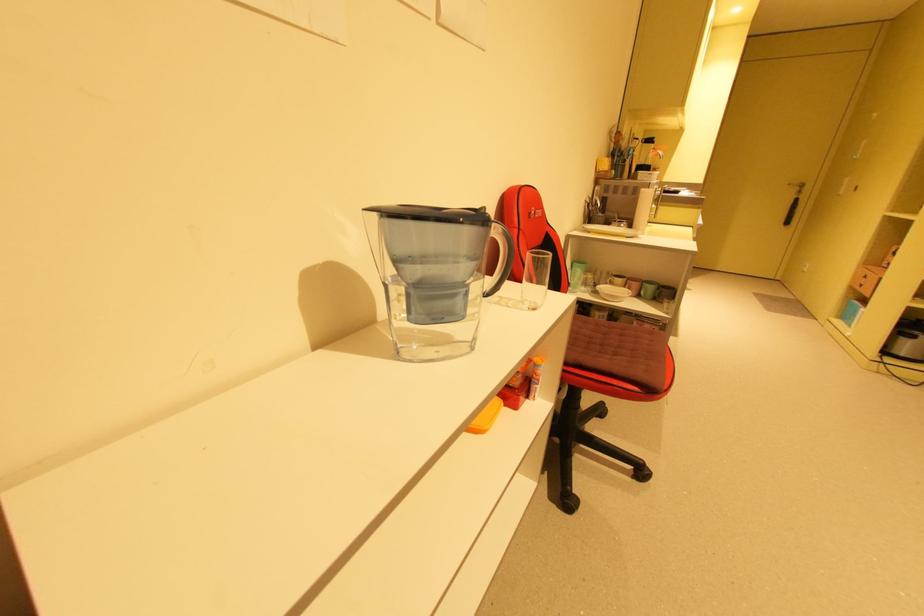
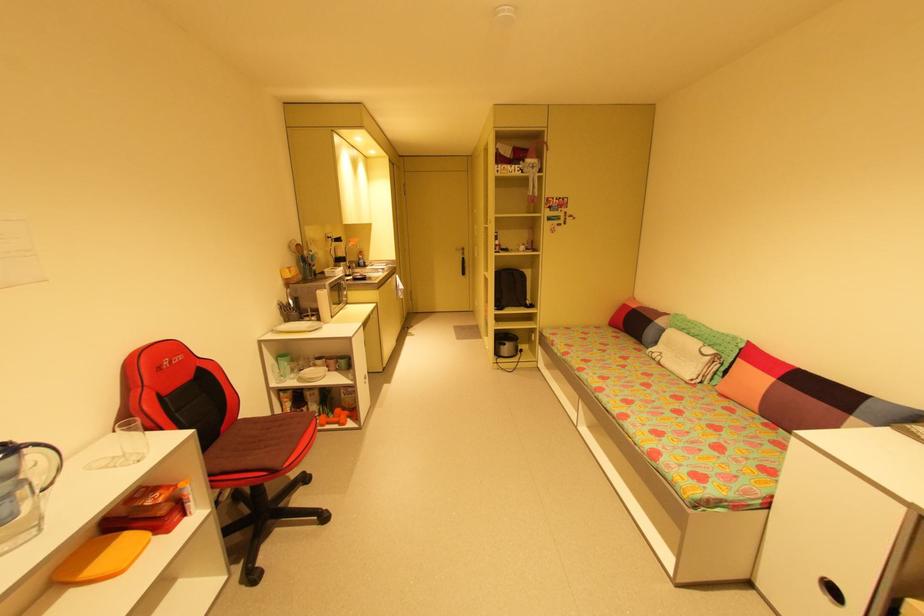
Locate, in the second image, the point that corresponds to pixel 794 185 in the first image.

(460, 249)